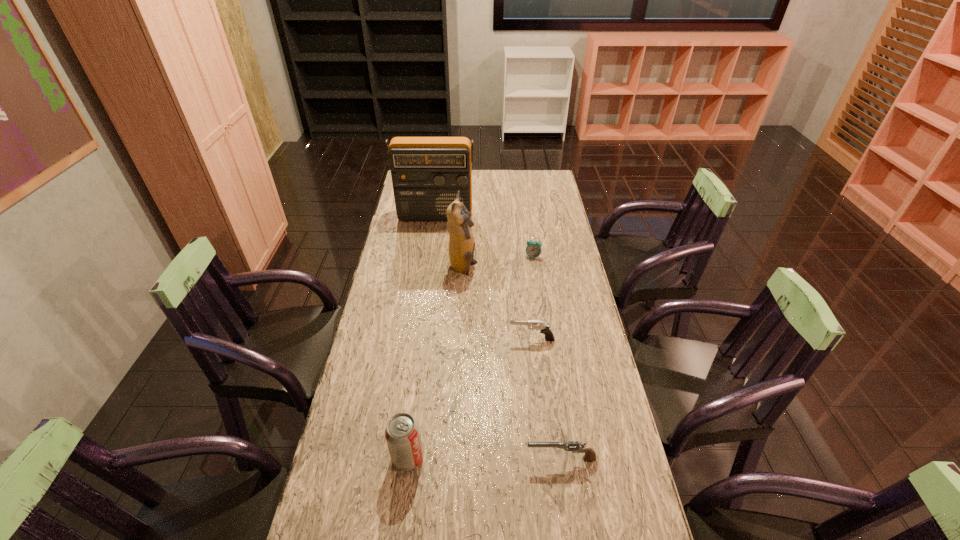
Find the location of a particular element. This screenshot has width=960, height=540. free space located 0.240m at the muzzle of the farther gun is located at coordinates (435, 339).

Locate an element on the screen. This screenshot has height=540, width=960. vacant space situated 0.050m at the muzzle of the farther gun is located at coordinates (493, 339).

Locate an element on the screen. This screenshot has width=960, height=540. vacant area situated on the face of the second farthest object is located at coordinates (x=543, y=329).

Find the location of a particular element. free space located aiming along the barrel of the shorter gun is located at coordinates point(425,458).

Identify the location of free space located aiming along the barrel of the shorter gun. This screenshot has height=540, width=960. (475, 458).

Image resolution: width=960 pixels, height=540 pixels. I want to click on blank space located aiming along the barrel of the shorter gun, so click(x=391, y=458).

Locate an element on the screen. The height and width of the screenshot is (540, 960). radio receiver located in the left edge section of the desktop is located at coordinates (427, 172).

The height and width of the screenshot is (540, 960). Find the location of `soda can that is at the left edge`. soda can that is at the left edge is located at coordinates (402, 434).

Find the location of a particular element. alarm clock positioned at the right edge is located at coordinates (533, 249).

I want to click on free space at the left edge of the desktop, so click(400, 276).